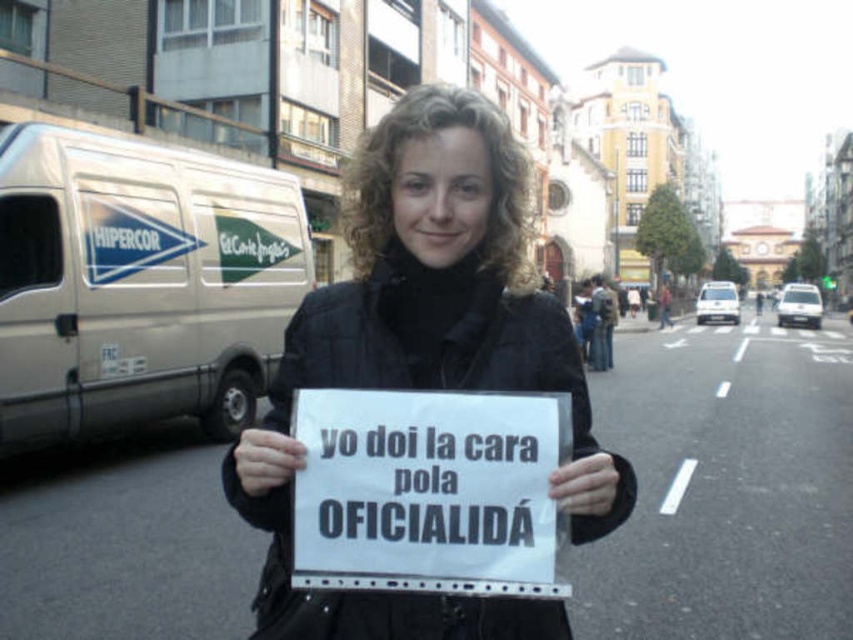
Question: Is black matte jacket at center wider than white paper sign at center?

Choices:
 (A) yes
 (B) no

Answer: (A)

Question: Among these objects, which one is farthest from the camera?

Choices:
 (A) black matte jacket at center
 (B) white paper sign at center

Answer: (B)

Question: Does black matte jacket at center appear under white paper sign at center?

Choices:
 (A) no
 (B) yes

Answer: (A)

Question: Which point is farther to the camera?

Choices:
 (A) white paper sign at center
 (B) black matte jacket at center

Answer: (A)

Question: Can you confirm if black matte jacket at center is positioned to the left of white paper sign at center?

Choices:
 (A) yes
 (B) no

Answer: (A)